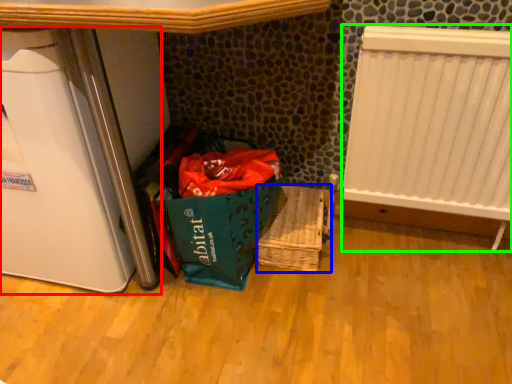
Question: Which object is the closest to the appliance (highlighted by a red box)? Choose among these: basket (highlighted by a blue box) or radiator (highlighted by a green box).

Choices:
 (A) basket
 (B) radiator

Answer: (A)